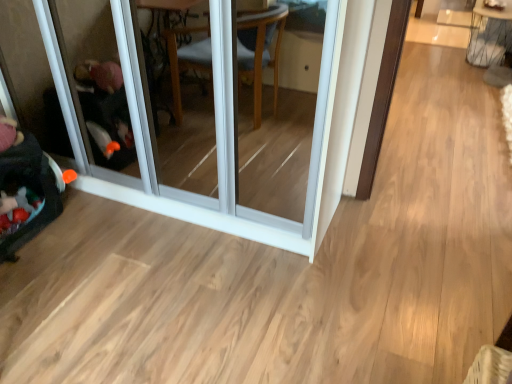
Locate an element on the screen. Image resolution: width=512 pixels, height=384 pixels. empty space that is to the right of velvet black baby carriage at left is located at coordinates (80, 235).